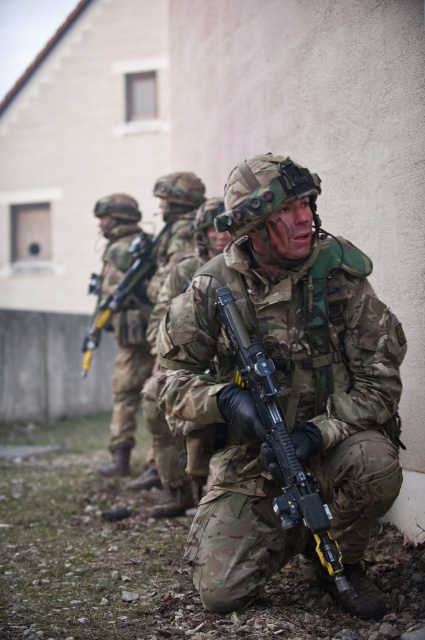
Between camouflage fabric rifle at center and camouflage fabric uniform at center, which one appears on the left side from the viewer's perspective?

camouflage fabric uniform at center

Locate an element on the screen. The height and width of the screenshot is (640, 425). camouflage fabric rifle at center is located at coordinates (283, 388).

The height and width of the screenshot is (640, 425). I want to click on camouflage fabric rifle at center, so click(283, 388).

Between camouflage fabric uniform at center and camouflage-patterned rifle at center, which one is positioned lower?

Positioned lower is camouflage-patterned rifle at center.

Who is positioned more to the right, camouflage fabric uniform at center or camouflage-patterned rifle at center?

camouflage-patterned rifle at center is more to the right.

Does point (116, 300) come in front of point (329, 552)?

No, it is not.

This screenshot has height=640, width=425. Find the location of `camouflage fabric uniform at center`. camouflage fabric uniform at center is located at coordinates (124, 324).

Who is more forward, (176, 419) or (255, 378)?

Point (255, 378)

Who is more distant from viewer, (356, 324) or (280, 513)?

Point (356, 324)

Find the location of `camouflage fabric rifle at center`. camouflage fabric rifle at center is located at coordinates (283, 388).